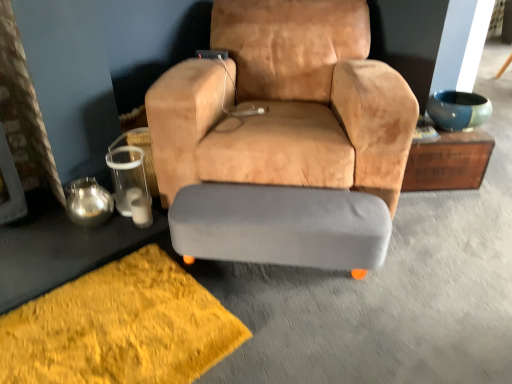
Find the location of `shaggy yellow rug at lower left`. shaggy yellow rug at lower left is located at coordinates (120, 327).

Measure the distance between wooden chest at upper right, the second table when ordered from bottom to top, and camera.

wooden chest at upper right, the second table when ordered from bottom to top, is 1.98 meters from camera.

What do you see at coordinates (61, 248) in the screenshot?
I see `metallic silver tray at lower left, the second table viewed from the right` at bounding box center [61, 248].

Locate an element on the screen. The image size is (512, 384). shaggy yellow rug at lower left is located at coordinates (120, 327).

Considering the relative sizes of metallic silver tray at lower left, which is the second table from top to bottom, and shaggy yellow rug at lower left in the image provided, is metallic silver tray at lower left, which is the second table from top to bottom, shorter than shaggy yellow rug at lower left?

Yes, metallic silver tray at lower left, which is the second table from top to bottom, is shorter than shaggy yellow rug at lower left.

From a real-world perspective, is metallic silver tray at lower left, marked as the first table in a bottom-to-top arrangement, physically above shaggy yellow rug at lower left?

Correct, in the physical world, metallic silver tray at lower left, marked as the first table in a bottom-to-top arrangement, is higher than shaggy yellow rug at lower left.

Considering the sizes of objects metallic silver tray at lower left, marked as the first table in a bottom-to-top arrangement, and shaggy yellow rug at lower left in the image provided, who is bigger, metallic silver tray at lower left, marked as the first table in a bottom-to-top arrangement, or shaggy yellow rug at lower left?

Bigger between the two is shaggy yellow rug at lower left.

Based on the photo, is metallic silver tray at lower left, which is the second table from top to bottom, inside the boundaries of shaggy yellow rug at lower left, or outside?

The correct answer is: outside.

Which is in front, point (207, 321) or point (321, 220)?

The point (207, 321) is in front.

Consider the image. Is shaggy yellow rug at lower left not close to gray fabric ottoman at center?

No, there isn't a large distance between shaggy yellow rug at lower left and gray fabric ottoman at center.

Is shaggy yellow rug at lower left taller or shorter than gray fabric ottoman at center?

Considering their sizes, shaggy yellow rug at lower left has less height than gray fabric ottoman at center.

Where is `doormat located underneath the gray fabric ottoman at center (from a real-world perspective)`? Image resolution: width=512 pixels, height=384 pixels. doormat located underneath the gray fabric ottoman at center (from a real-world perspective) is located at coordinates (120, 327).

Is suede tan armchair at center in front of or behind wooden chest at upper right, which is the second table in left-to-right order, in the image?

Clearly, suede tan armchair at center is in front of wooden chest at upper right, which is the second table in left-to-right order.

Based on the photo, from the image's perspective, between suede tan armchair at center and wooden chest at upper right, which ranks as the first table in right-to-left order, which one is located above?

suede tan armchair at center, from the image's perspective.

Locate an element on the screen. chair above the wooden chest at upper right, which appears as the first table when viewed from the top (from the image's perspective) is located at coordinates (283, 138).

Is suede tan armchair at center not near wooden chest at upper right, which appears as the first table when viewed from the top?

No, there isn't a large distance between suede tan armchair at center and wooden chest at upper right, which appears as the first table when viewed from the top.

Is wooden chest at upper right, the second table when ordered from bottom to top, bigger or smaller than metallic silver tray at lower left, the second table viewed from the right?

Clearly, wooden chest at upper right, the second table when ordered from bottom to top, is larger in size than metallic silver tray at lower left, the second table viewed from the right.

Is metallic silver tray at lower left, the second table viewed from the right, completely or partially inside wooden chest at upper right, which is the second table in left-to-right order?

That's incorrect, metallic silver tray at lower left, the second table viewed from the right, is not inside wooden chest at upper right, which is the second table in left-to-right order.

In the image, there is a metallic silver tray at lower left, which is the second table from top to bottom. At what (x,y) coordinates should I click in order to perform the action: click on table above it (from the image's perspective). Please return your answer as a coordinate pair (x, y). Image resolution: width=512 pixels, height=384 pixels. Looking at the image, I should click on tap(448, 161).

Who is smaller, wooden chest at upper right, which is the second table in left-to-right order, or shaggy yellow rug at lower left?

With smaller size is shaggy yellow rug at lower left.

Looking at this image, which object is thinner, wooden chest at upper right, which appears as the first table when viewed from the top, or shaggy yellow rug at lower left?

wooden chest at upper right, which appears as the first table when viewed from the top.

From the image's perspective, is wooden chest at upper right, which appears as the first table when viewed from the top, located above shaggy yellow rug at lower left?

Correct, wooden chest at upper right, which appears as the first table when viewed from the top, appears higher than shaggy yellow rug at lower left in the image.

Considering the sizes of gray fabric ottoman at center and shaggy yellow rug at lower left in the image, is gray fabric ottoman at center wider or thinner than shaggy yellow rug at lower left?

In the image, gray fabric ottoman at center appears to be more narrow than shaggy yellow rug at lower left.

From a real-world perspective, between gray fabric ottoman at center and shaggy yellow rug at lower left, who is vertically lower?

From a 3D spatial view, shaggy yellow rug at lower left is below.

Is gray fabric ottoman at center positioned beyond the bounds of shaggy yellow rug at lower left?

Yes.

From the image's perspective, would you say gray fabric ottoman at center is positioned over shaggy yellow rug at lower left?

Yes, from the image's perspective, gray fabric ottoman at center is over shaggy yellow rug at lower left.

How different are the orientations of shaggy yellow rug at lower left and wooden chest at upper right, which appears as the first table when viewed from the top, in degrees?

40 degrees separate the facing orientations of shaggy yellow rug at lower left and wooden chest at upper right, which appears as the first table when viewed from the top.

Is wooden chest at upper right, the second table when ordered from bottom to top, at the back of shaggy yellow rug at lower left?

No, shaggy yellow rug at lower left is not facing the opposite direction of wooden chest at upper right, the second table when ordered from bottom to top.

Which of these two, shaggy yellow rug at lower left or wooden chest at upper right, the second table when ordered from bottom to top, is bigger?

Bigger between the two is wooden chest at upper right, the second table when ordered from bottom to top.

Between shaggy yellow rug at lower left and wooden chest at upper right, which appears as the first table when viewed from the top, which one appears on the right side from the viewer's perspective?

From the viewer's perspective, wooden chest at upper right, which appears as the first table when viewed from the top, appears more on the right side.

Locate an element on the screen. Image resolution: width=512 pixels, height=384 pixels. doormat lying in front of the metallic silver tray at lower left, the 1th table from the left is located at coordinates (120, 327).

At what (x,y) coordinates should I click in order to perform the action: click on doormat on the left of gray fabric ottoman at center. Please return your answer as a coordinate pair (x, y). The width and height of the screenshot is (512, 384). Looking at the image, I should click on (120, 327).

Estimate the real-world distances between objects in this image. Which object is further from shaggy yellow rug at lower left, suede tan armchair at center or metallic silver tray at lower left, marked as the first table in a bottom-to-top arrangement?

suede tan armchair at center lies further to shaggy yellow rug at lower left than the other object.

When comparing their distances from suede tan armchair at center, does gray fabric ottoman at center or wooden chest at upper right, which is the second table in left-to-right order, seem closer?

gray fabric ottoman at center is positioned closer to the anchor suede tan armchair at center.

Which object lies further to the anchor point wooden chest at upper right, which ranks as the first table in right-to-left order, shaggy yellow rug at lower left or metallic silver tray at lower left, the second table viewed from the right?

metallic silver tray at lower left, the second table viewed from the right, is positioned further to the anchor wooden chest at upper right, which ranks as the first table in right-to-left order.

Estimate the real-world distances between objects in this image. Which object is closer to suede tan armchair at center, gray fabric ottoman at center or shaggy yellow rug at lower left?

gray fabric ottoman at center lies closer to suede tan armchair at center than the other object.

Which object lies further to the anchor point metallic silver tray at lower left, the second table viewed from the right, suede tan armchair at center or wooden chest at upper right, which is the second table in left-to-right order?

wooden chest at upper right, which is the second table in left-to-right order.

When comparing their distances from wooden chest at upper right, the second table when ordered from bottom to top, does shaggy yellow rug at lower left or gray fabric ottoman at center seem further?

Among the two, shaggy yellow rug at lower left is located further to wooden chest at upper right, the second table when ordered from bottom to top.

Based on their spatial positions, is shaggy yellow rug at lower left or metallic silver tray at lower left, the 1th table from the left, further from suede tan armchair at center?

metallic silver tray at lower left, the 1th table from the left, lies further to suede tan armchair at center than the other object.

Based on their spatial positions, is metallic silver tray at lower left, the 1th table from the left, or wooden chest at upper right, which is the second table in left-to-right order, further from suede tan armchair at center?

wooden chest at upper right, which is the second table in left-to-right order, is positioned further to the anchor suede tan armchair at center.

At what (x,y) coordinates should I click in order to perform the action: click on doormat between metallic silver tray at lower left, marked as the first table in a bottom-to-top arrangement, and suede tan armchair at center. Please return your answer as a coordinate pair (x, y). This screenshot has height=384, width=512. Looking at the image, I should click on (120, 327).

Find the location of a particular element. Image resolution: width=512 pixels, height=384 pixels. swivel chair between suede tan armchair at center and shaggy yellow rug at lower left vertically is located at coordinates (281, 226).

The height and width of the screenshot is (384, 512). I want to click on swivel chair between metallic silver tray at lower left, the 1th table from the left, and suede tan armchair at center, so click(x=281, y=226).

The image size is (512, 384). I want to click on swivel chair between shaggy yellow rug at lower left and wooden chest at upper right, which appears as the first table when viewed from the top, so click(x=281, y=226).